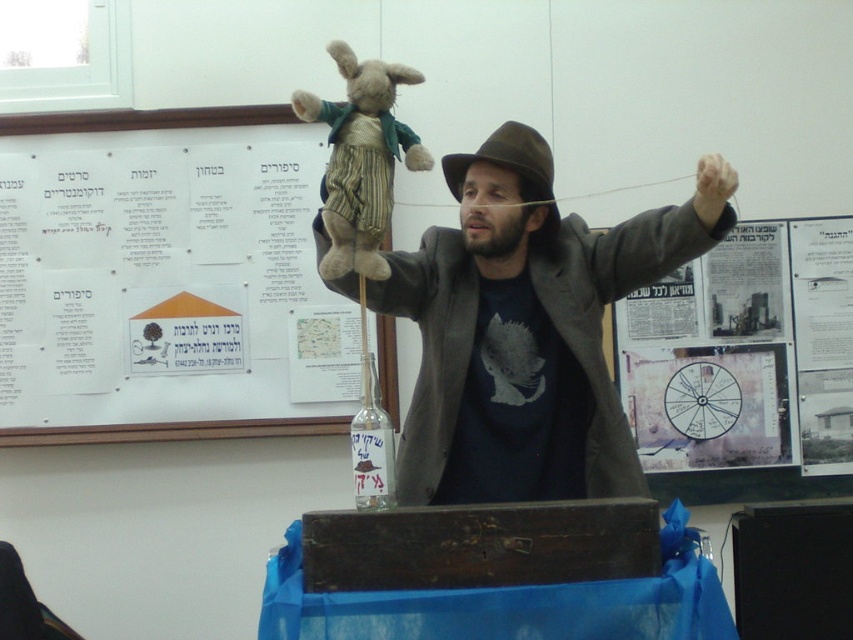
You are a photographer who needs to position your camera exactly 2.36 meters away from the transparent glass bottle at center. Based on the scene description, where should you place your camera?

The camera should be placed 2.36 meters away from the transparent glass bottle at center as specified in the objects description.

You are an assistant organizing the presentation materials. The white paper at upper left needs to be moved to the center of the board. Can you determine its current position relative to the center?

The white paper at upper left is located at point (167, 289), which is to the left and above the center of the board.

From the picture: You are a photographer setting up for a group photo. You need to ensure that both the fuzzy brown teddy bear at upper center and the brown felt fedora at center are visible in the frame. Based on their sizes, which object might require you to adjust the camera angle to include it in the shot?

The fuzzy brown teddy bear at upper center might be wider than the brown felt fedora at center, so it could require adjusting the camera angle to ensure it fits within the frame.